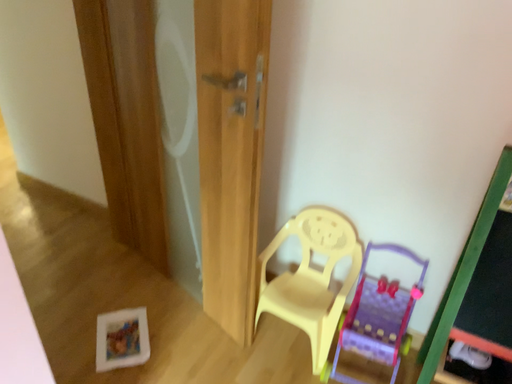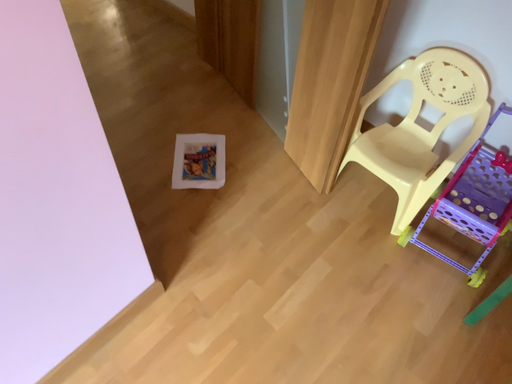
Question: How did the camera likely rotate when shooting the video?

Choices:
 (A) rotated upward
 (B) rotated downward

Answer: (B)